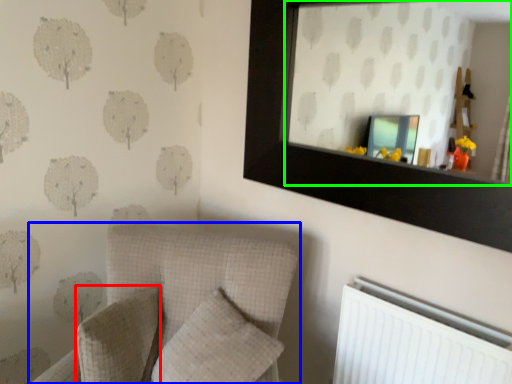
Question: Which object is positioned farthest from pillow (highlighted by a red box)? Select from furniture (highlighted by a blue box) and mirror (highlighted by a green box).

Choices:
 (A) furniture
 (B) mirror

Answer: (B)